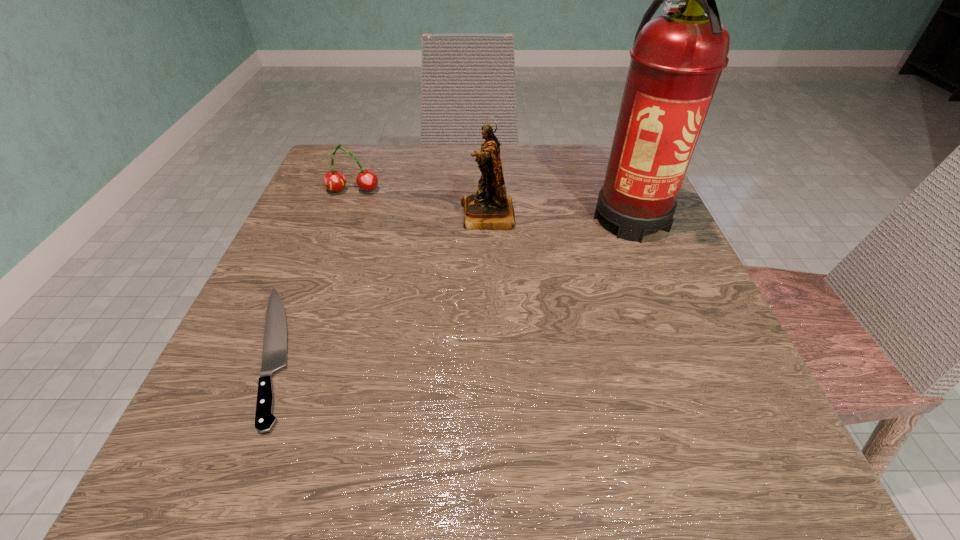
The height and width of the screenshot is (540, 960). In the image, there is a desktop. Identify the location of vacant space at the near right corner. (742, 423).

Find the location of a particular element. free space that is in between the nearest object and the rightmost object is located at coordinates (452, 284).

Identify the location of empty space between the figurine and the rightmost object. This screenshot has height=540, width=960. (x=559, y=216).

Locate an element on the screen. empty space that is in between the rightmost object and the steak knife is located at coordinates (452, 284).

At what (x,y) coordinates should I click in order to perform the action: click on unoccupied position between the third shortest object and the shortest object. Please return your answer as a coordinate pair (x, y). The height and width of the screenshot is (540, 960). Looking at the image, I should click on coord(381,284).

The height and width of the screenshot is (540, 960). I want to click on free space between the figurine and the third tallest object, so click(x=420, y=203).

I want to click on vacant space in between the figurine and the fire extinguisher, so click(x=559, y=216).

Locate an element on the screen. This screenshot has height=540, width=960. free space between the figurine and the second shortest object is located at coordinates (420, 203).

What are the coordinates of `the second closest object relative to the fire extinguisher` in the screenshot? It's located at (367, 180).

Locate which object ranks second in proximity to the nearest object. Please provide its 2D coordinates. Your answer should be formatted as a tuple, i.e. [(x, y)], where the tuple contains the x and y coordinates of a point satisfying the conditions above.

[(367, 180)]